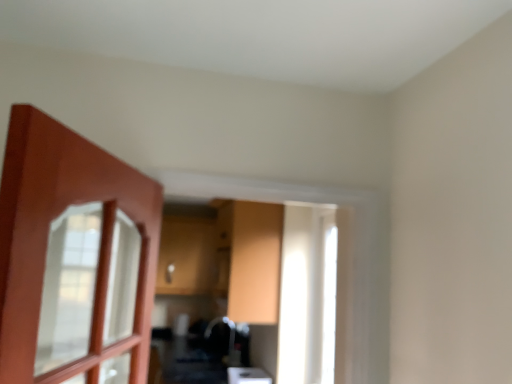
What do you see at coordinates (222, 254) in the screenshot? I see `matte wood dresser at center` at bounding box center [222, 254].

Locate an element on the screen. The height and width of the screenshot is (384, 512). matte wood dresser at center is located at coordinates (222, 254).

Identify the location of matte wood dresser at center. The height and width of the screenshot is (384, 512). (222, 254).